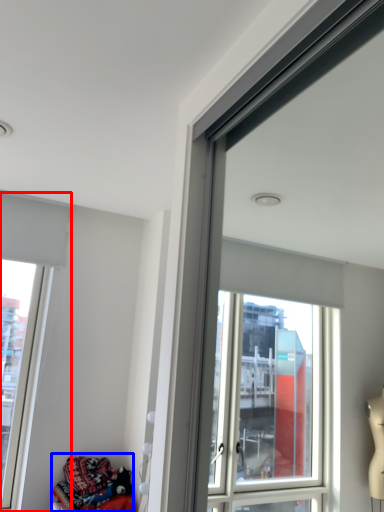
Question: Among these objects, which one is nearest to the camera, window (highlighted by a red box) or clothing (highlighted by a blue box)?

Choices:
 (A) window
 (B) clothing

Answer: (B)